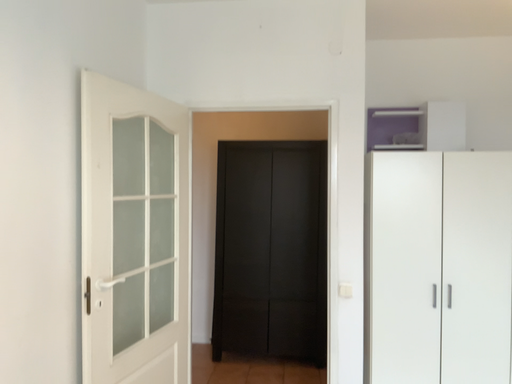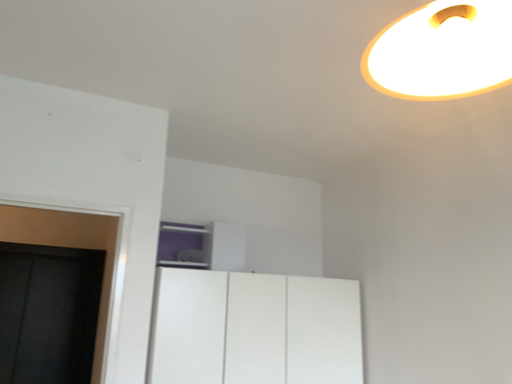
Question: Which way did the camera rotate in the video?

Choices:
 (A) rotated right
 (B) rotated left

Answer: (A)